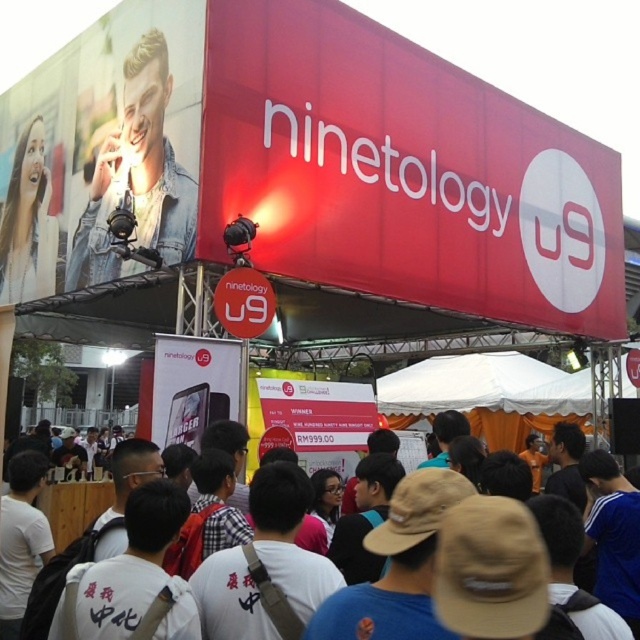
You are organizing a photo shoot for the event and need to ensure that both the matte black phone at center and the smooth skin face at upper left are clearly visible in the frame. Given their sizes, which object should you focus on first to ensure proper framing?

The matte black phone at center is smaller than the smooth skin face at upper left, so you should focus on the smooth skin face at upper left first to ensure it fits within the frame before adjusting for the smaller phone.

You are organizing a promotional event and need to place a new banner that is 1.2 meters wide. You have two options from the image, the red matte sign at upper center and the white paper sign at center. Which sign can accommodate the new banner without needing to be resized?

The red matte sign at upper center has a larger width than the white paper sign at center, so the red matte sign at upper center can accommodate the 1.2 meters wide banner without needing to be resized.

You are at the event and want to take a photo of the denim jacket at upper left and the smooth skin face at upper left. Which object should you zoom in more on to capture details, considering their sizes?

The denim jacket at upper left is wider than the smooth skin face at upper left, so you should zoom in more on the smooth skin face at upper left to capture its details since it is smaller.